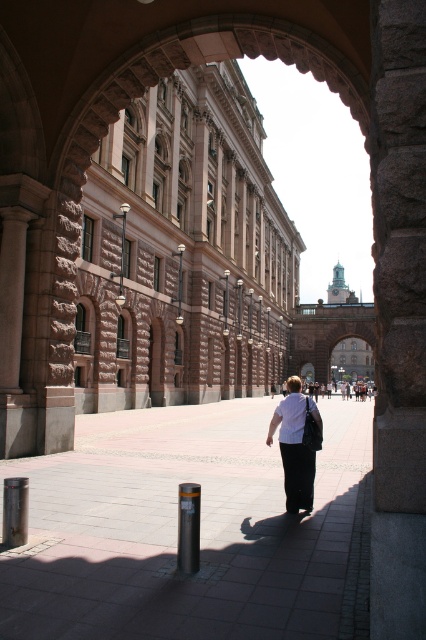
Does point (307, 483) come farther from viewer compared to point (181, 522)?

Yes, it is.

The width and height of the screenshot is (426, 640). Describe the element at coordinates (296, 445) in the screenshot. I see `white matte shirt at center` at that location.

Is point (296, 451) more distant than point (184, 534)?

That is True.

Identify the location of white matte shirt at center. (296, 445).

You are a GUI agent. You are given a task and a screenshot of the screen. Output one action in this format:
    pyautogui.click(x=<x>, y=<y>)
    Task: Click on the smooth concrete pavement at center
    The height and width of the screenshot is (640, 426).
    Given the screenshot: What is the action you would take?
    pyautogui.click(x=201, y=531)

Which is more to the left, smooth concrete pavement at center or white matte shirt at center?

Positioned to the left is smooth concrete pavement at center.

Is point (48, 564) behind point (290, 497)?

No, it is not.

Where is `smooth concrete pavement at center`? This screenshot has width=426, height=640. smooth concrete pavement at center is located at coordinates (201, 531).

Describe the element at coordinates (201, 531) in the screenshot. I see `smooth concrete pavement at center` at that location.

Does point (314, 592) lie in front of point (178, 541)?

Yes, point (314, 592) is in front of point (178, 541).

Locate an element on the screen. This screenshot has width=426, height=640. smooth concrete pavement at center is located at coordinates (201, 531).